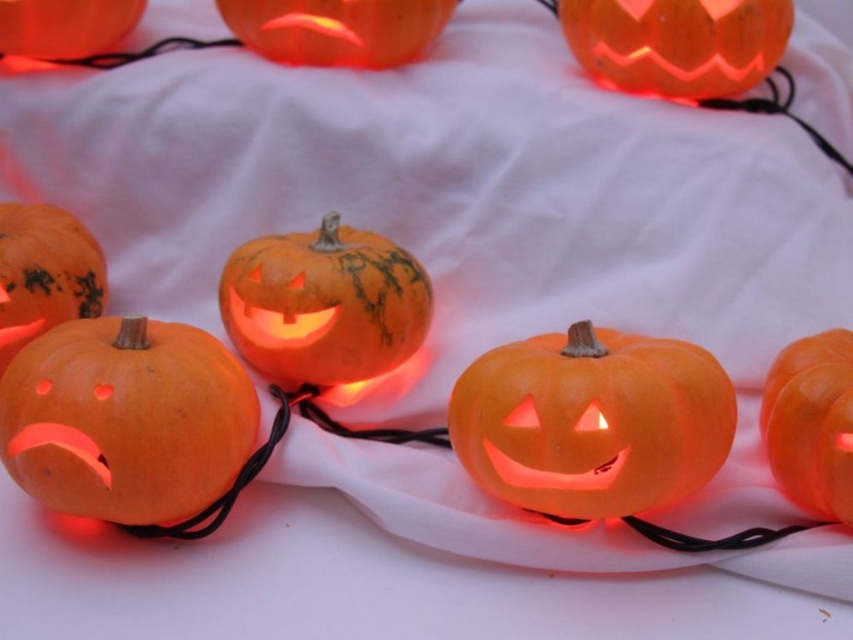
You are standing in front of the Halloween display and want to pick up the closest pumpkin to you. Which pumpkin should you choose between the orange matte carved pumpkin at lower left and the matte orange pumpkin at upper left?

The orange matte carved pumpkin at lower left is closer to the viewer than the matte orange pumpkin at upper left, so you should choose the orange matte carved pumpkin at lower left.

In the scene shown: You are standing in front of a Halloween display of carved pumpkins. You see a point marked at coordinates (335, 28). Which pumpkin is located at that point?

The point at (335, 28) marks the orange matte pumpkin at upper center.